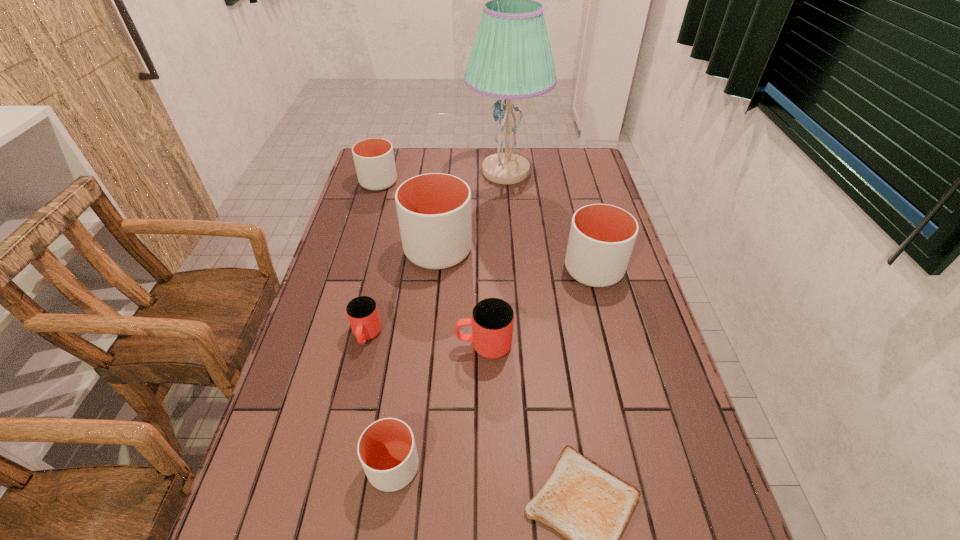
Where is `the smallest white cup`? This screenshot has width=960, height=540. the smallest white cup is located at coordinates (386, 449).

The width and height of the screenshot is (960, 540). I want to click on the left pink cup, so click(x=362, y=312).

The image size is (960, 540). I want to click on vacant space located on the left of the tallest object, so click(x=415, y=172).

I want to click on vacant point located on the right of the biggest white cup, so click(x=519, y=250).

Where is `free space located 0.400m on the front of the rightmost white cup`? free space located 0.400m on the front of the rightmost white cup is located at coordinates (634, 421).

Identify the location of free space located on the right of the farthest white cup. (429, 182).

Identify the location of vacant space located on the handle side of the bigger pink cup. The height and width of the screenshot is (540, 960). (401, 345).

Identify the location of free space located on the handle side of the bigger pink cup. click(405, 345).

This screenshot has width=960, height=540. Identify the location of free space located on the handle side of the bigger pink cup. (386, 345).

You are a GUI agent. You are given a task and a screenshot of the screen. Output one action in this format:
    pyautogui.click(x=<x>, y=<y>)
    Task: Click on the free region located 0.120m on the left of the smallest white cup
    Image resolution: width=960 pixels, height=540 pixels.
    Given the screenshot: What is the action you would take?
    pyautogui.click(x=310, y=467)